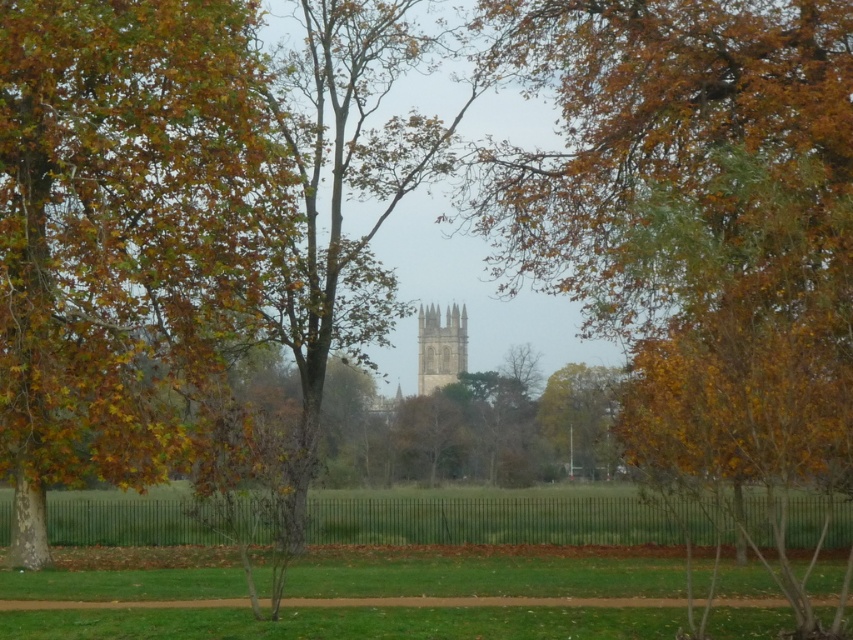
You are standing on the dirt path in the foreground of the scene. You want to pick up the autumn leaves at left. In which direction should you walk from your current position to reach them?

The autumn leaves at left are located at point 0.364 on the horizontal axis and 0.142 on the vertical axis. Since you are on the dirt path running horizontally across the frame, you should walk towards the left to reach the autumn leaves at left.

You are standing on the dirt path in the foreground and want to walk towards the gray stone bell tower at center. Will you first pass by the brown leafy tree at center before reaching the tower?

Yes, since the brown leafy tree at center is closer to the viewer than the gray stone bell tower at center, you will pass by the brown leafy tree at center before reaching the tower.

In the scene shown: You are standing at the edge of the dirt path in the autumn scene. You want to walk straight towards the brown leafy tree at center. How far will you have to walk to reach it?

The brown leafy tree at center is 18.09 meters from the viewer, so you will have to walk approximately 18.09 meters to reach it.